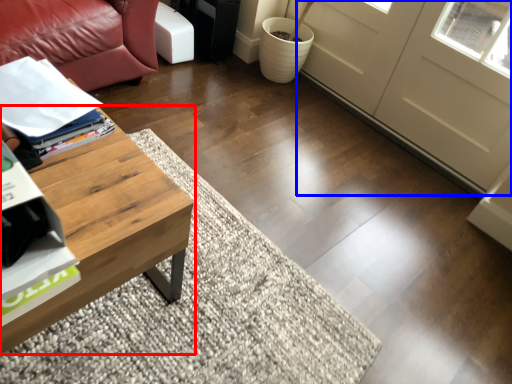
Question: Which object is further to the camera taking this photo, coffee table (highlighted by a red box) or screen door (highlighted by a blue box)?

Choices:
 (A) coffee table
 (B) screen door

Answer: (B)